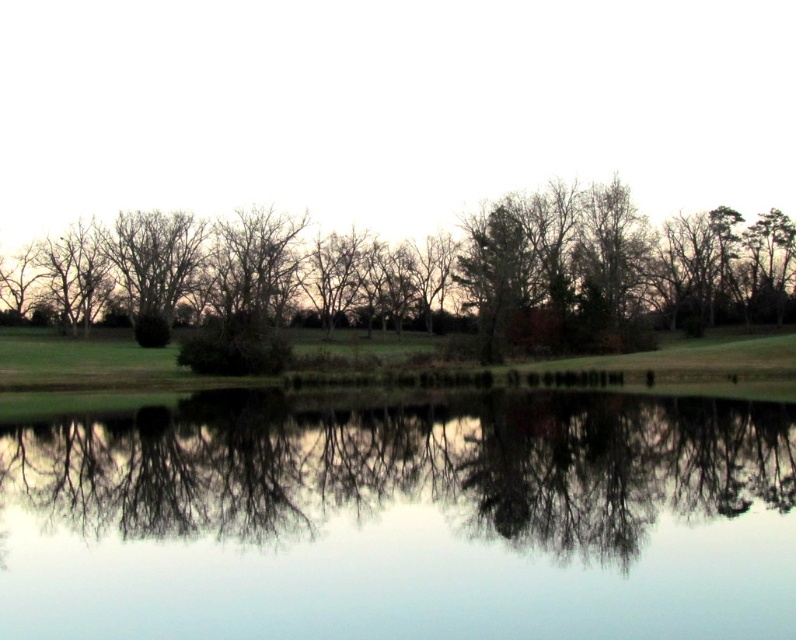
Between transparent water at center and green leafy tree at center, which one has more height?

green leafy tree at center

Measure the distance between transparent water at center and green leafy tree at center.

44.65 meters

Does point (572, 509) come closer to viewer compared to point (254, 225)?

Yes.

Where is `transparent water at center`? The height and width of the screenshot is (640, 796). transparent water at center is located at coordinates (404, 518).